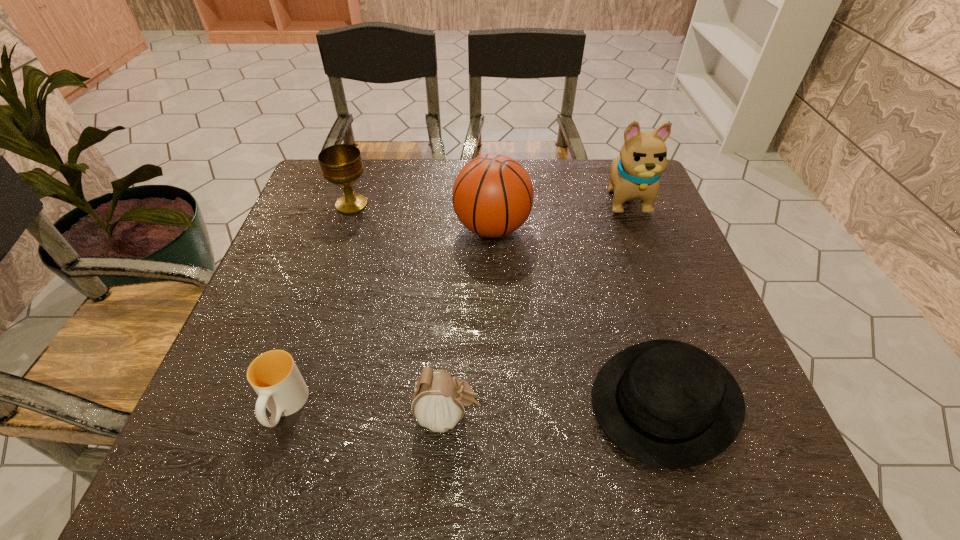
Locate an element on the screen. The image size is (960, 540). vacant region between the fedora and the fourth shortest object is located at coordinates (509, 302).

At what (x,y) coordinates should I click in order to perform the action: click on object that ranks as the closest to the cup. Please return your answer as a coordinate pair (x, y). Looking at the image, I should click on (439, 401).

At what (x,y) coordinates should I click in order to perform the action: click on object identified as the second closest to the cup. Please return your answer as a coordinate pair (x, y). This screenshot has height=540, width=960. Looking at the image, I should click on (492, 196).

This screenshot has width=960, height=540. Identify the location of vacant area in the image that satisfies the following two spatial constraints: 1. on the front side of the second tallest object; 2. on the right side of the shortest object. (497, 401).

Image resolution: width=960 pixels, height=540 pixels. Find the location of `vacant region that satisfies the following two spatial constraints: 1. on the front side of the fedora; 2. on the left side of the second tallest object`. vacant region that satisfies the following two spatial constraints: 1. on the front side of the fedora; 2. on the left side of the second tallest object is located at coordinates (497, 401).